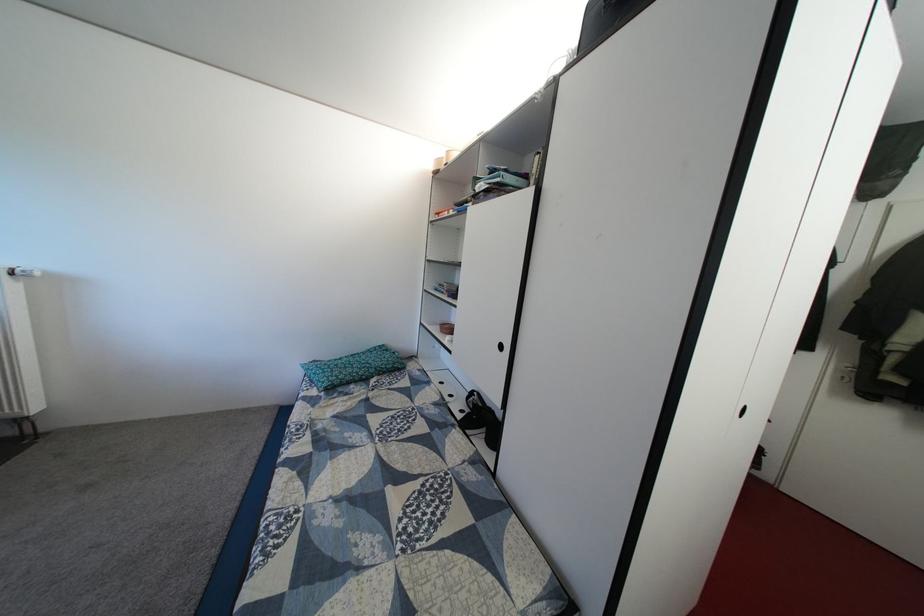
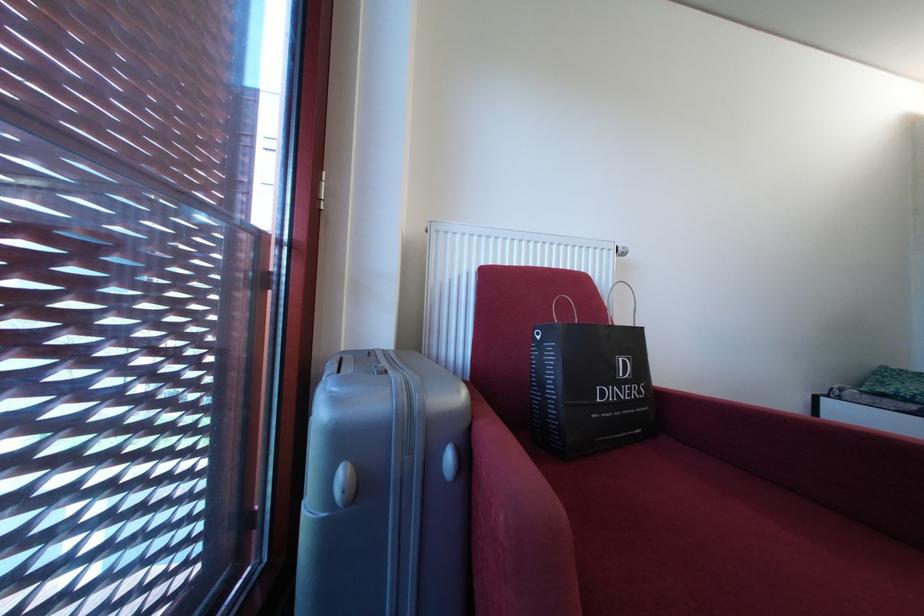
Question: Which direction would the cameraman need to move to produce the second image? Reply with the corresponding letter.

Choices:
 (A) Left
 (B) Right
 (C) Forward
 (D) Backward

Answer: (A)